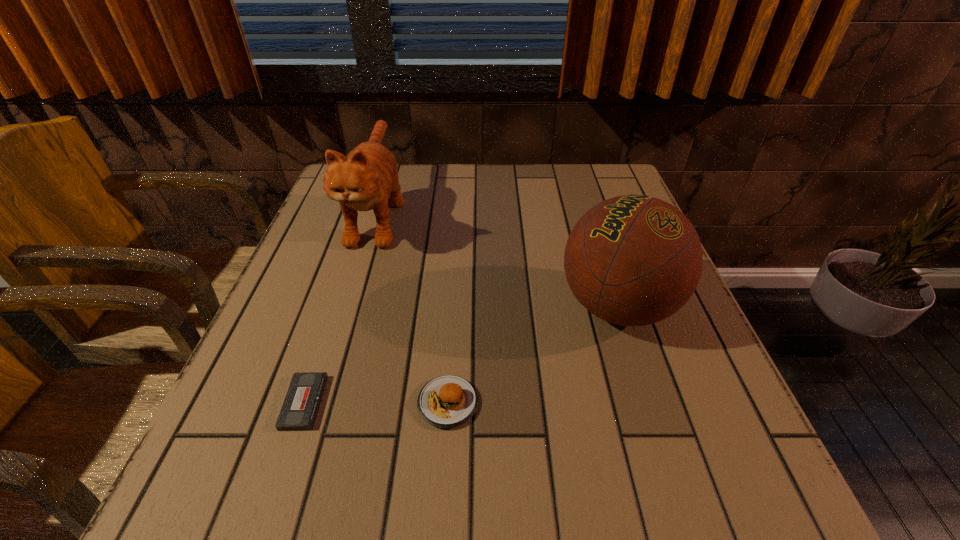
Where is `the farthest object`? The image size is (960, 540). the farthest object is located at coordinates (362, 181).

Where is `the rightmost object`? Image resolution: width=960 pixels, height=540 pixels. the rightmost object is located at coordinates (632, 260).

You are a GUI agent. You are given a task and a screenshot of the screen. Output one action in this format:
    pyautogui.click(x=<x>, y=<y>)
    Task: Click on the second farthest object
    The width and height of the screenshot is (960, 540).
    Given the screenshot: What is the action you would take?
    pyautogui.click(x=632, y=260)

Where is `the third object from left to right`? This screenshot has width=960, height=540. the third object from left to right is located at coordinates (448, 401).

Locate an element on the screen. This screenshot has height=540, width=960. the second shortest object is located at coordinates (448, 401).

Find the location of a particular element. videotape is located at coordinates (300, 408).

The width and height of the screenshot is (960, 540). I want to click on vacant region located on the face of the cat, so click(354, 290).

Image resolution: width=960 pixels, height=540 pixels. Identify the location of vacant space located 0.140m on the front of the rightmost object. (655, 424).

Find the location of a particular element. free space located 0.230m on the right of the second object from right to left is located at coordinates (616, 403).

This screenshot has height=540, width=960. Identify the location of vacant space located 0.180m on the right of the videotape. (430, 402).